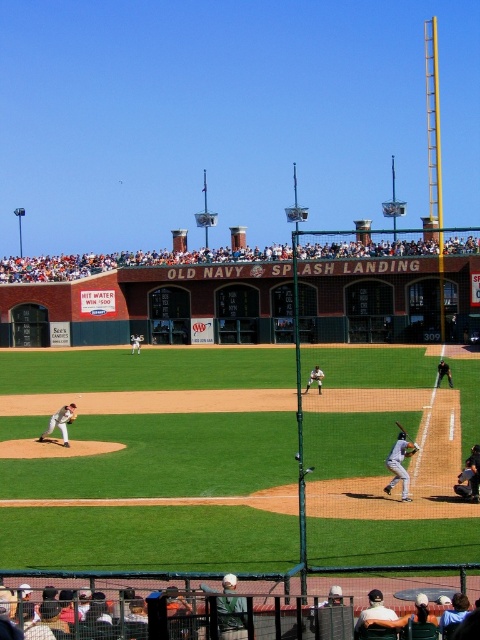
Between gray uniform bat at right and wooden baseball bat at lower center, which one is positioned higher?

Positioned higher is gray uniform bat at right.

Is point (444, 376) closer to camera compared to point (403, 426)?

No.

I want to click on gray uniform bat at right, so click(x=444, y=372).

Who is higher up, matte gray uniform at center or white baseball glove at center?

white baseball glove at center is above.

This screenshot has width=480, height=640. What are the coordinates of `matte gray uniform at center` in the screenshot? It's located at (60, 422).

Which is in front, point (55, 419) or point (136, 340)?

Point (55, 419) is more forward.

Locate an element on the screen. Image resolution: width=480 pixels, height=640 pixels. matte gray uniform at center is located at coordinates (60, 422).

This screenshot has height=640, width=480. Describe the element at coordinates (126, 262) in the screenshot. I see `orange fabric crowd at upper center` at that location.

Does orange fabric crowd at upper center have a lesser height compared to white baseball glove at center?

No.

Is point (81, 262) positioned in front of point (139, 339)?

No, (81, 262) is behind (139, 339).

Where is `orange fabric crowd at upper center`? Image resolution: width=480 pixels, height=640 pixels. orange fabric crowd at upper center is located at coordinates (126, 262).